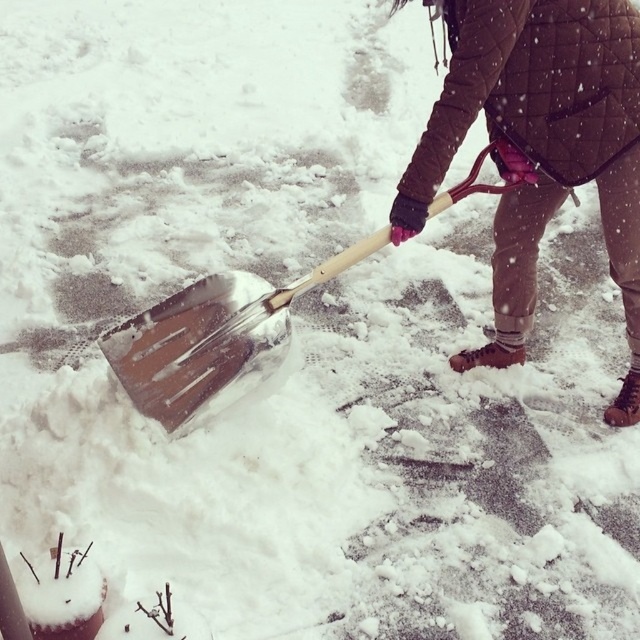
Question: Can you confirm if brown quilted jacket at upper center is positioned to the right of brushed metal shovel at center?

Choices:
 (A) yes
 (B) no

Answer: (A)

Question: Does brown quilted jacket at upper center appear over brushed metal shovel at center?

Choices:
 (A) no
 (B) yes

Answer: (B)

Question: Which of the following is the farthest from the observer?

Choices:
 (A) (556, 4)
 (B) (248, 342)

Answer: (B)

Question: Considering the relative positions of brown quilted jacket at upper center and brushed metal shovel at center in the image provided, where is brown quilted jacket at upper center located with respect to brushed metal shovel at center?

Choices:
 (A) above
 (B) below

Answer: (A)